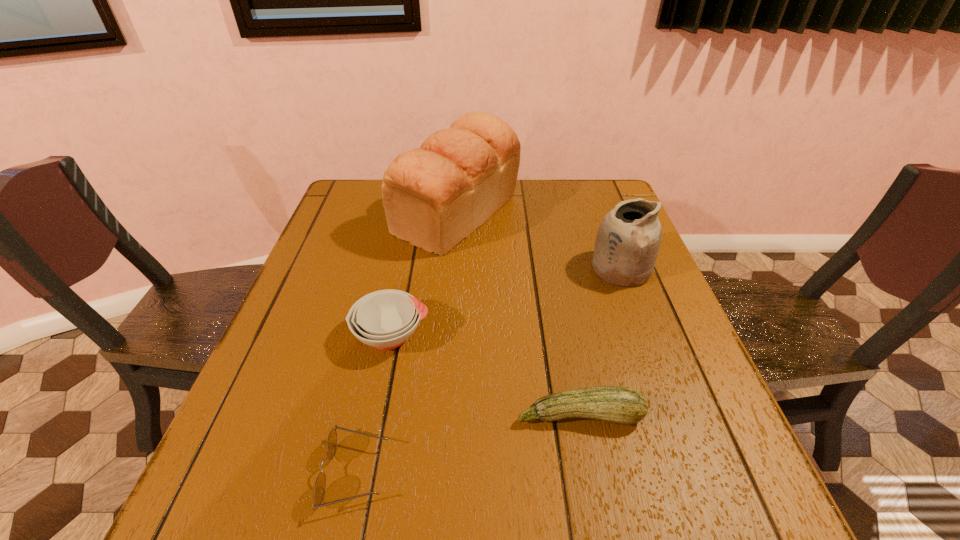
You are a GUI agent. You are given a task and a screenshot of the screen. Output one action in this format:
    pyautogui.click(x=<x>, y=<y>)
    Task: Click on the free space at the near right corner of the desktop
    This screenshot has height=540, width=960.
    Given the screenshot: What is the action you would take?
    pyautogui.click(x=680, y=531)

I want to click on free space between the bread and the soup bowl, so click(x=424, y=275).

This screenshot has height=540, width=960. I want to click on free spot between the zucchini and the pottery, so click(x=600, y=342).

Where is `unoccupied area between the second nearest object and the fourth shortest object`? unoccupied area between the second nearest object and the fourth shortest object is located at coordinates (600, 342).

Find the location of a particular element. Image resolution: width=960 pixels, height=540 pixels. blank region between the second nearest object and the third farthest object is located at coordinates point(485,375).

The width and height of the screenshot is (960, 540). Find the location of `blank region between the nearest object and the tallest object`. blank region between the nearest object and the tallest object is located at coordinates (406, 343).

Locate an element on the screen. The image size is (960, 540). free space that is in between the spectacles and the third farthest object is located at coordinates (373, 404).

Image resolution: width=960 pixels, height=540 pixels. In order to click on empty space that is in between the shortest object and the pottery in this screenshot , I will do `click(489, 371)`.

This screenshot has height=540, width=960. In order to click on free area in between the bread and the spectacles in this screenshot , I will do `click(406, 343)`.

The image size is (960, 540). Find the location of `free spot between the pottery and the second nearest object`. free spot between the pottery and the second nearest object is located at coordinates (600, 342).